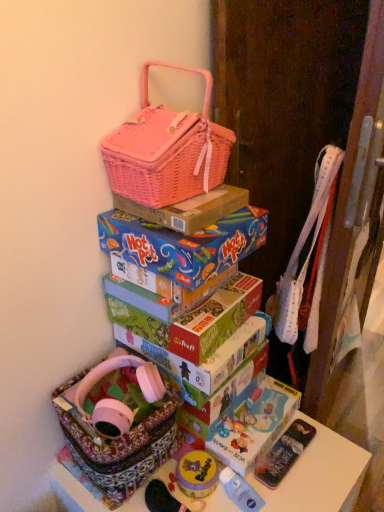
Question: From a real-world perspective, is pink wicker basket at upper center, the second box positioned from the bottom, over pink wicker basket at upper center?

Choices:
 (A) yes
 (B) no

Answer: (B)

Question: Does pink wicker basket at upper center, which is the first box in top-to-bottom order, appear on the right side of pink wicker basket at upper center?

Choices:
 (A) yes
 (B) no

Answer: (A)

Question: Considering the relative sizes of pink wicker basket at upper center, which is the first box in top-to-bottom order, and pink wicker basket at upper center in the image provided, is pink wicker basket at upper center, which is the first box in top-to-bottom order, taller than pink wicker basket at upper center?

Choices:
 (A) yes
 (B) no

Answer: (B)

Question: From the image's perspective, is pink wicker basket at upper center, the second box positioned from the bottom, on top of pink wicker basket at upper center?

Choices:
 (A) yes
 (B) no

Answer: (B)

Question: Can you confirm if pink wicker basket at upper center, which is the first box in top-to-bottom order, is bigger than pink wicker basket at upper center?

Choices:
 (A) no
 (B) yes

Answer: (A)

Question: Are pink wicker basket at upper center, which is the first box in top-to-bottom order, and pink wicker basket at upper center beside each other?

Choices:
 (A) no
 (B) yes

Answer: (B)

Question: Can you confirm if blue cardboard hot pot box at center, which appears as the second box when viewed from the top, is positioned to the left of pink wicker basket at upper center?

Choices:
 (A) yes
 (B) no

Answer: (B)

Question: Considering the relative positions of blue cardboard hot pot box at center, which appears as the second box when viewed from the top, and pink wicker basket at upper center in the image provided, is blue cardboard hot pot box at center, which appears as the second box when viewed from the top, to the right of pink wicker basket at upper center from the viewer's perspective?

Choices:
 (A) no
 (B) yes

Answer: (B)

Question: Can you confirm if blue cardboard hot pot box at center, placed as the 1th box when sorted from bottom to top, is thinner than pink wicker basket at upper center?

Choices:
 (A) yes
 (B) no

Answer: (B)

Question: From a real-world perspective, is blue cardboard hot pot box at center, placed as the 1th box when sorted from bottom to top, physically above pink wicker basket at upper center?

Choices:
 (A) yes
 (B) no

Answer: (B)

Question: From a real-world perspective, is blue cardboard hot pot box at center, which appears as the second box when viewed from the top, beneath pink wicker basket at upper center?

Choices:
 (A) yes
 (B) no

Answer: (A)

Question: Is blue cardboard hot pot box at center, placed as the 1th box when sorted from bottom to top, oriented away from pink wicker basket at upper center?

Choices:
 (A) no
 (B) yes

Answer: (A)

Question: Does floral fabric basket at lower left have a smaller size compared to patterned fabric basket at lower left?

Choices:
 (A) no
 (B) yes

Answer: (B)